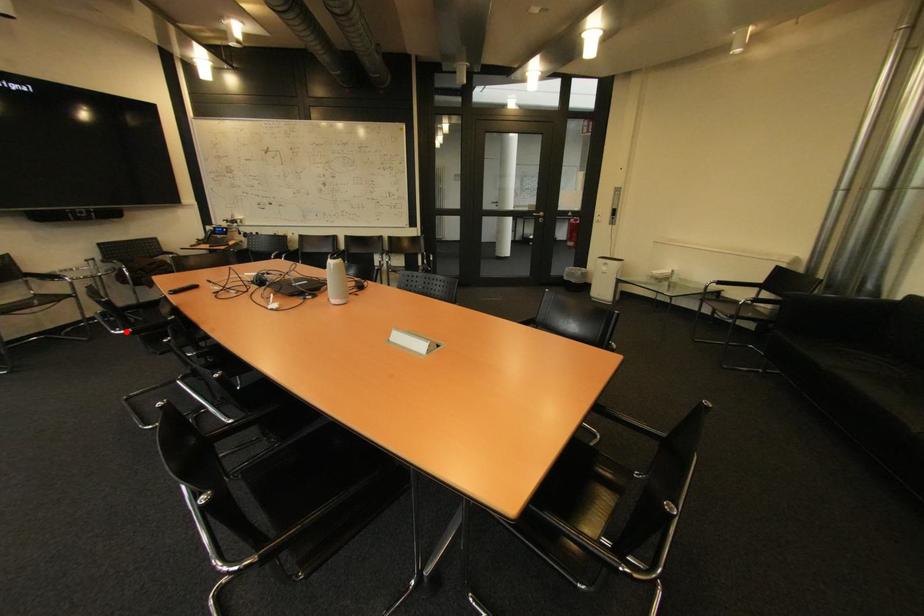
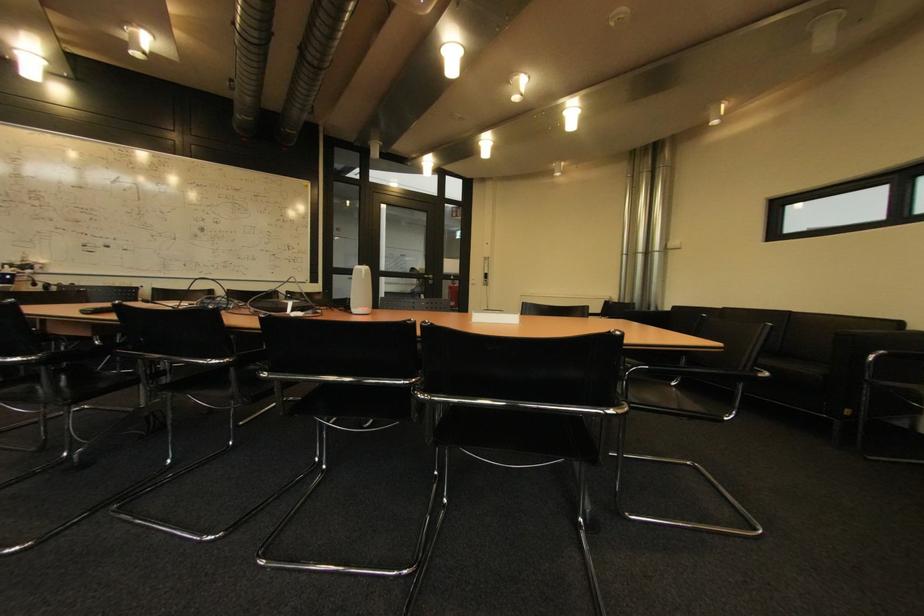
Question: I am providing you with two images of the same scene from different viewpoints. A red point is marked on the first image. At the location where the point appears in image 1, is it still visible in image 2?

Choices:
 (A) Yes
 (B) No

Answer: (A)